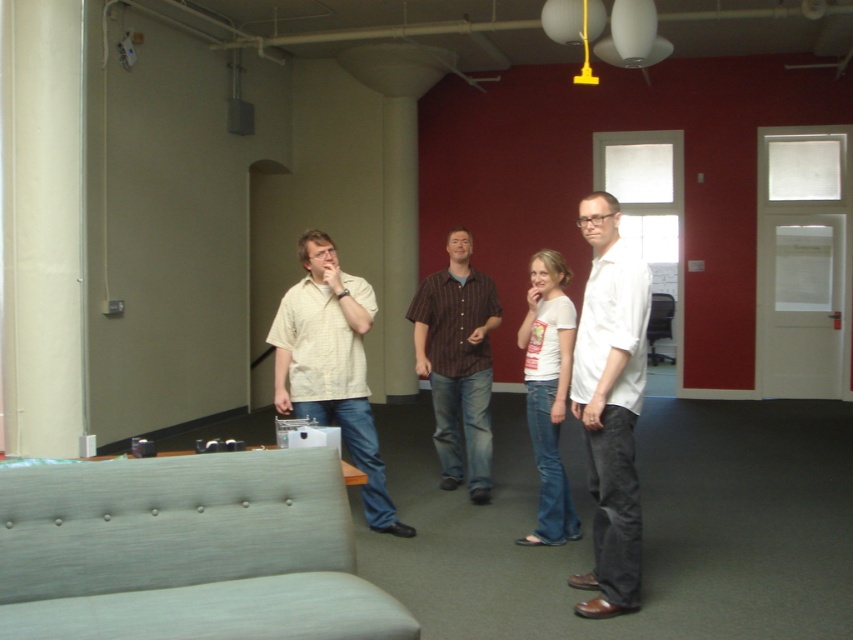
Question: Which of the following is the farthest from the observer?

Choices:
 (A) brown striped shirt at center
 (B) matte beige shirt at center
 (C) white matte shirt at center

Answer: (A)

Question: Can you confirm if white matte shirt at center is bigger than matte beige shirt at center?

Choices:
 (A) no
 (B) yes

Answer: (A)

Question: Which object appears closest to the camera in this image?

Choices:
 (A) matte beige shirt at center
 (B) white matte shirt at center
 (C) brown striped shirt at center
 (D) white cotton t-shirt at center

Answer: (B)

Question: From the image, what is the correct spatial relationship of brown striped shirt at center in relation to white cotton t-shirt at center?

Choices:
 (A) right
 (B) left

Answer: (B)

Question: Is white matte shirt at center below matte beige shirt at center?

Choices:
 (A) no
 (B) yes

Answer: (A)

Question: Which object is farther from the camera taking this photo?

Choices:
 (A) matte beige shirt at center
 (B) brown striped shirt at center

Answer: (B)